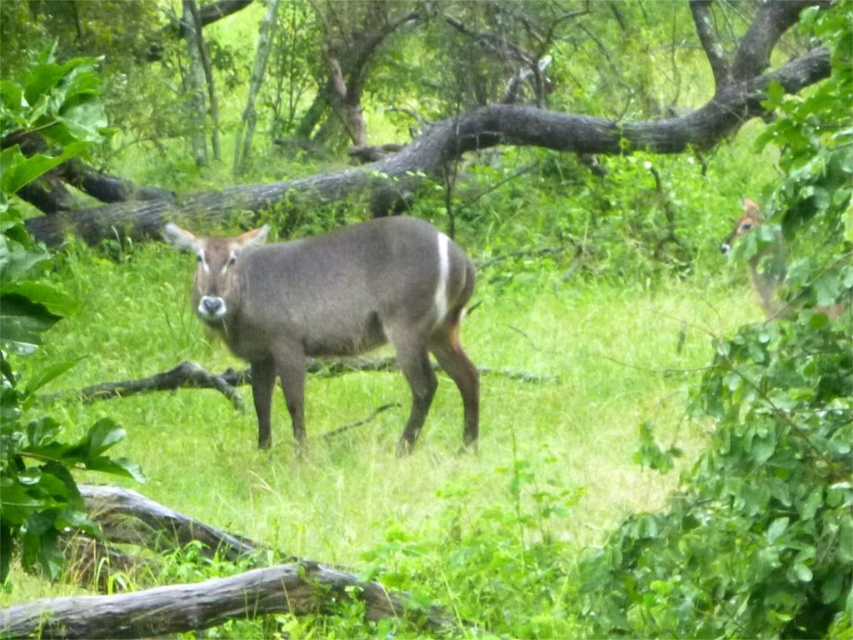
You are an ecologist observing this natural scene. You notice the green leafy tree at center and the brown velvet deer at upper right. Based on their positions, which object is located to the right side of the other?

The green leafy tree at center is to the right of the brown velvet deer at upper right, so the brown velvet deer at upper right is positioned to the left of the green leafy tree at center.

You are a photographer aiming to capture a clear image of the gray matte deer at center and the green leafy tree at center. Since you want both subjects in focus, which one should you adjust your camera focus on first?

The gray matte deer at center is closer to the viewer than the green leafy tree at center, so you should focus on the gray matte deer at center first to ensure both are in focus.

Consider the image. You are an animal tracker observing the antelope in the scene. You notice two points marked in the image. The first point is at coordinates point (283, 349), and the second is at point (759, 218). Based on their positions, which point is closer to the antelope?

Point (283, 349) is in front of point (759, 218), so it is closer to the antelope.